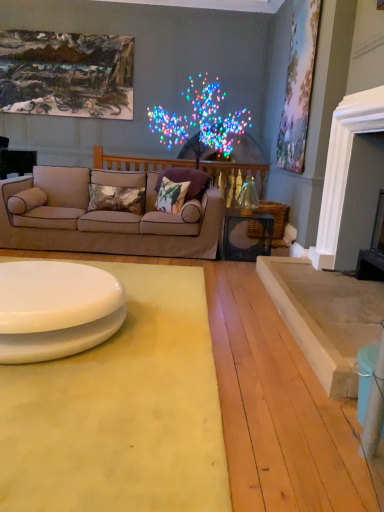
Where is `textured floral pillow at center, which is counted as the 2th pillow, starting from the left`? This screenshot has width=384, height=512. textured floral pillow at center, which is counted as the 2th pillow, starting from the left is located at coordinates (117, 198).

How much space does oil painting at upper left, which appears as the 1th picture frame when viewed from the left, occupy horizontally?

The width of oil painting at upper left, which appears as the 1th picture frame when viewed from the left, is 3.52 inches.

You are a GUI agent. You are given a task and a screenshot of the screen. Output one action in this format:
    pyautogui.click(x=<x>, y=<y>)
    Task: Click on the beige fabric couch at center
    This screenshot has height=512, width=384.
    Given the screenshot: What is the action you would take?
    pyautogui.click(x=103, y=217)

Image resolution: width=384 pixels, height=512 pixels. What do you see at coordinates (103, 217) in the screenshot?
I see `beige fabric couch at center` at bounding box center [103, 217].

What do you see at coordinates (27, 200) in the screenshot? I see `satin beige pillow at left, which is the 1th pillow in left-to-right order` at bounding box center [27, 200].

In order to face satin beige pillow at left, which is the 1th pillow in left-to-right order, should I rotate leftwards or rightwards?

To face it directly, rotate left by 21.007 degrees.

At what (x,y) coordinates should I click in order to perform the action: click on white glossy table at lower left, the 1th table viewed from the front. Please return your answer as a coordinate pair (x, y). This screenshot has height=512, width=384. Looking at the image, I should click on (56, 309).

The height and width of the screenshot is (512, 384). Find the location of `pastel floral canvas at upper right, arranged as the first picture frame when viewed from the right`. pastel floral canvas at upper right, arranged as the first picture frame when viewed from the right is located at coordinates (298, 85).

Is clear glass table at center, the 1th table in the back-to-front sequence, far away from textured floral pillow at center, which is counted as the 2th pillow, starting from the left?

Yes, clear glass table at center, the 1th table in the back-to-front sequence, is far from textured floral pillow at center, which is counted as the 2th pillow, starting from the left.

Is clear glass table at center, which appears as the 2th table when viewed from the front, aimed at textured floral pillow at center, which is counted as the 2th pillow, starting from the left?

No, clear glass table at center, which appears as the 2th table when viewed from the front, is not facing towards textured floral pillow at center, which is counted as the 2th pillow, starting from the left.

Based on the photo, is clear glass table at center, the 1th table in the back-to-front sequence, closer to the viewer compared to textured floral pillow at center, the third pillow in the right-to-left sequence?

Yes, clear glass table at center, the 1th table in the back-to-front sequence, is closer to the camera.

Between clear glass table at center, which appears as the second table when viewed from the left, and textured floral pillow at center, the third pillow in the right-to-left sequence, which one has larger size?

clear glass table at center, which appears as the second table when viewed from the left.

Considering the relative positions of white glossy table at lower left, arranged as the second table when viewed from the top, and satin beige pillow at left, which is the 1th pillow in left-to-right order, in the image provided, is white glossy table at lower left, arranged as the second table when viewed from the top, to the left of satin beige pillow at left, which is the 1th pillow in left-to-right order, from the viewer's perspective?

No.

Is white glossy table at lower left, the 1th table viewed from the left, facing away from satin beige pillow at left, marked as the 4th pillow in a right-to-left arrangement?

white glossy table at lower left, the 1th table viewed from the left, is not turned away from satin beige pillow at left, marked as the 4th pillow in a right-to-left arrangement.

From the picture: Considering the sizes of objects white glossy table at lower left, which is counted as the second table, starting from the right, and satin beige pillow at left, which is the 1th pillow in left-to-right order, in the image provided, who is shorter, white glossy table at lower left, which is counted as the second table, starting from the right, or satin beige pillow at left, which is the 1th pillow in left-to-right order,?

With less height is white glossy table at lower left, which is counted as the second table, starting from the right.

Is white glossy table at lower left, arranged as the second table when viewed from the top, with satin beige pillow at left, which is the 1th pillow in left-to-right order?

white glossy table at lower left, arranged as the second table when viewed from the top, is not next to satin beige pillow at left, which is the 1th pillow in left-to-right order, and they're not touching.

Which is correct: textured floral pillow at center, the third pillow in the right-to-left sequence, is inside pastel floral canvas at upper right, the second picture frame when ordered from back to front, or outside of it?

textured floral pillow at center, the third pillow in the right-to-left sequence, exists outside the volume of pastel floral canvas at upper right, the second picture frame when ordered from back to front.

From a real-world perspective, relative to pastel floral canvas at upper right, placed as the 1th picture frame when sorted from front to back, is textured floral pillow at center, the third pillow in the right-to-left sequence, vertically above or below?

textured floral pillow at center, the third pillow in the right-to-left sequence, is below pastel floral canvas at upper right, placed as the 1th picture frame when sorted from front to back.

Is textured floral pillow at center, which is counted as the 2th pillow, starting from the left, oriented away from pastel floral canvas at upper right, arranged as the first picture frame when viewed from the right?

No, textured floral pillow at center, which is counted as the 2th pillow, starting from the left, is not facing the opposite direction of pastel floral canvas at upper right, arranged as the first picture frame when viewed from the right.

Between textured floral pillow at center, which is counted as the 2th pillow, starting from the left, and pastel floral canvas at upper right, placed as the 1th picture frame when sorted from front to back, which one appears on the left side from the viewer's perspective?

textured floral pillow at center, which is counted as the 2th pillow, starting from the left.

Considering the relative sizes of satin beige pillow at left, which is the 1th pillow in left-to-right order, and clear glass table at center, the 1th table in the top-to-bottom sequence, in the image provided, is satin beige pillow at left, which is the 1th pillow in left-to-right order, thinner than clear glass table at center, the 1th table in the top-to-bottom sequence,?

Correct, the width of satin beige pillow at left, which is the 1th pillow in left-to-right order, is less than that of clear glass table at center, the 1th table in the top-to-bottom sequence.

Considering the relative sizes of satin beige pillow at left, which is the 1th pillow in left-to-right order, and clear glass table at center, which appears as the 2th table when ordered from the bottom, in the image provided, is satin beige pillow at left, which is the 1th pillow in left-to-right order, smaller than clear glass table at center, which appears as the 2th table when ordered from the bottom,?

Correct, satin beige pillow at left, which is the 1th pillow in left-to-right order, occupies less space than clear glass table at center, which appears as the 2th table when ordered from the bottom.

From a real-world perspective, is satin beige pillow at left, marked as the 4th pillow in a right-to-left arrangement, positioned above or below clear glass table at center, the 1th table in the top-to-bottom sequence?

satin beige pillow at left, marked as the 4th pillow in a right-to-left arrangement, is above clear glass table at center, the 1th table in the top-to-bottom sequence.

From the image's perspective, is satin beige pillow at left, which is the 1th pillow in left-to-right order, located above or below clear glass table at center, placed as the first table when sorted from right to left?

Clearly, from the image's perspective, satin beige pillow at left, which is the 1th pillow in left-to-right order, is above clear glass table at center, placed as the first table when sorted from right to left.

Which object is closer to the camera, white glossy table at lower left, which is counted as the second table, starting from the right, or pastel floral canvas at upper right, placed as the 1th picture frame when sorted from front to back?

Positioned in front is white glossy table at lower left, which is counted as the second table, starting from the right.

Is white glossy table at lower left, the 1th table viewed from the front, bigger than pastel floral canvas at upper right, the second picture frame when ordered from back to front?

Yes, white glossy table at lower left, the 1th table viewed from the front, is bigger than pastel floral canvas at upper right, the second picture frame when ordered from back to front.

In the scene shown: From a real-world perspective, between white glossy table at lower left, arranged as the second table when viewed from the top, and pastel floral canvas at upper right, which appears as the second picture frame when viewed from the left, who is vertically higher?

From a 3D spatial view, pastel floral canvas at upper right, which appears as the second picture frame when viewed from the left, is above.

In the scene shown: Looking at their sizes, would you say white glossy table at lower left, which is the second table from back to front, is wider or thinner than pastel floral canvas at upper right, the second picture frame when ordered from back to front?

white glossy table at lower left, which is the second table from back to front, is wider than pastel floral canvas at upper right, the second picture frame when ordered from back to front.

Could you measure the distance between oil painting at upper left, the first picture frame when ordered from back to front, and floral-patterned fabric pillow at center, which is the 2th pillow in right-to-left order?

oil painting at upper left, the first picture frame when ordered from back to front, is 1.97 meters away from floral-patterned fabric pillow at center, which is the 2th pillow in right-to-left order.

Looking at this image, from a real-world perspective, which is physically above, oil painting at upper left, which appears as the 1th picture frame when viewed from the left, or floral-patterned fabric pillow at center, which is the 3th pillow in left-to-right order?

oil painting at upper left, which appears as the 1th picture frame when viewed from the left.

Consider the image. Are oil painting at upper left, which is counted as the 2th picture frame, starting from the right, and floral-patterned fabric pillow at center, which is the 3th pillow in left-to-right order, far apart?

Yes, oil painting at upper left, which is counted as the 2th picture frame, starting from the right, and floral-patterned fabric pillow at center, which is the 3th pillow in left-to-right order, are located far from each other.

Is oil painting at upper left, which is counted as the 2th picture frame, starting from the right, outside of floral-patterned fabric pillow at center, which is the 3th pillow in left-to-right order?

Yes, oil painting at upper left, which is counted as the 2th picture frame, starting from the right, is not within floral-patterned fabric pillow at center, which is the 3th pillow in left-to-right order.

This screenshot has width=384, height=512. There is a clear glass table at center, the 1th table in the top-to-bottom sequence. Find the location of `the 3rd pillow above it (from the image's perspective)`. the 3rd pillow above it (from the image's perspective) is located at coordinates (171, 196).

Based on the photo, is clear glass table at center, the 1th table in the top-to-bottom sequence, a part of floral-patterned fabric pillow at center, which is the 3th pillow in left-to-right order?

Definitely not — clear glass table at center, the 1th table in the top-to-bottom sequence, is not inside floral-patterned fabric pillow at center, which is the 3th pillow in left-to-right order.

Between floral-patterned fabric pillow at center, which is the 3th pillow in left-to-right order, and clear glass table at center, the 1th table in the back-to-front sequence, which one has less height?

With less height is floral-patterned fabric pillow at center, which is the 3th pillow in left-to-right order.

In the scene shown: Considering the sizes of objects floral-patterned fabric pillow at center, which is the 2th pillow in right-to-left order, and clear glass table at center, which appears as the second table when viewed from the left, in the image provided, who is bigger, floral-patterned fabric pillow at center, which is the 2th pillow in right-to-left order, or clear glass table at center, which appears as the second table when viewed from the left,?

Bigger between the two is clear glass table at center, which appears as the second table when viewed from the left.

At what (x,y) coordinates should I click in order to perform the action: click on the 3rd pillow to the left of the clear glass table at center, which appears as the 2th table when viewed from the front, starting your count from the anchor. Please return your answer as a coordinate pair (x, y). This screenshot has height=512, width=384. Looking at the image, I should click on (117, 198).

From the image's perspective, which pillow is the 1st one above the white glossy table at lower left, the 1th table viewed from the left? Please provide its 2D coordinates.

[(27, 200)]

Consider the image. From the image, which object appears to be farther from clear glass table at center, which appears as the 2th table when ordered from the bottom, oil painting at upper left, which appears as the 1th picture frame when viewed from the left, or yellow fabric mat at lower center?

Based on the image, oil painting at upper left, which appears as the 1th picture frame when viewed from the left, appears to be further to clear glass table at center, which appears as the 2th table when ordered from the bottom.

Estimate the real-world distances between objects in this image. Which object is closer to clear glass table at center, placed as the first table when sorted from right to left, beige fabric couch at center or textured floral pillow at center, which is counted as the 2th pillow, starting from the left?

beige fabric couch at center lies closer to clear glass table at center, placed as the first table when sorted from right to left, than the other object.

Based on their spatial positions, is clear glass table at center, which appears as the second table when viewed from the left, or satin beige pillow at left, which is the 1th pillow in left-to-right order, closer to white glossy table at lower left, the 1th table viewed from the front?

satin beige pillow at left, which is the 1th pillow in left-to-right order, is closer to white glossy table at lower left, the 1th table viewed from the front.

From the image, which object appears to be farther from pastel floral canvas at upper right, placed as the 1th picture frame when sorted from front to back, textured floral pillow at center, the third pillow in the right-to-left sequence, or white glossy table at lower left, the 1th table viewed from the left?

The object further to pastel floral canvas at upper right, placed as the 1th picture frame when sorted from front to back, is white glossy table at lower left, the 1th table viewed from the left.

From the image, which object appears to be nearer to clear glass table at center, which appears as the 2th table when ordered from the bottom, beige fabric couch at center or fluffy fabric pillow at center, which ranks as the fourth pillow in left-to-right order?

fluffy fabric pillow at center, which ranks as the fourth pillow in left-to-right order, lies closer to clear glass table at center, which appears as the 2th table when ordered from the bottom, than the other object.

Looking at the image, which one is located further to oil painting at upper left, the first picture frame when ordered from back to front, fluffy fabric pillow at center, the 1th pillow from the right, or textured floral pillow at center, the third pillow in the right-to-left sequence?

fluffy fabric pillow at center, the 1th pillow from the right, lies further to oil painting at upper left, the first picture frame when ordered from back to front, than the other object.

From the picture: When comparing their distances from textured floral pillow at center, the third pillow in the right-to-left sequence, does floral-patterned fabric pillow at center, which is the 3th pillow in left-to-right order, or beige fabric couch at center seem closer?

beige fabric couch at center lies closer to textured floral pillow at center, the third pillow in the right-to-left sequence, than the other object.

From the image, which object appears to be farther from clear glass table at center, the 1th table in the top-to-bottom sequence, yellow fabric mat at lower center or pastel floral canvas at upper right, which appears as the second picture frame when viewed from the left?

Among the two, yellow fabric mat at lower center is located further to clear glass table at center, the 1th table in the top-to-bottom sequence.

This screenshot has width=384, height=512. What are the coordinates of `studio couch between yellow fabric mat at lower center and textured floral pillow at center, which is counted as the 2th pillow, starting from the left, along the z-axis` in the screenshot? It's located at (103, 217).

You are a GUI agent. You are given a task and a screenshot of the screen. Output one action in this format:
    pyautogui.click(x=<x>, y=<y>)
    Task: Click on the table between white glossy table at lower left, the 1th table viewed from the left, and floral-patterned fabric pillow at center, which is the 2th pillow in right-to-left order, from front to back
    This screenshot has height=512, width=384.
    Given the screenshot: What is the action you would take?
    pyautogui.click(x=252, y=245)

Locate an element on the screen. This screenshot has width=384, height=512. studio couch between white glossy table at lower left, the first table from the bottom, and floral-patterned fabric pillow at center, which is the 2th pillow in right-to-left order, in the front-back direction is located at coordinates (103, 217).

The height and width of the screenshot is (512, 384). Find the location of `studio couch located between white glossy table at lower left, the 1th table viewed from the front, and oil painting at upper left, the first picture frame when ordered from back to front, in the depth direction`. studio couch located between white glossy table at lower left, the 1th table viewed from the front, and oil painting at upper left, the first picture frame when ordered from back to front, in the depth direction is located at coordinates [x=103, y=217].